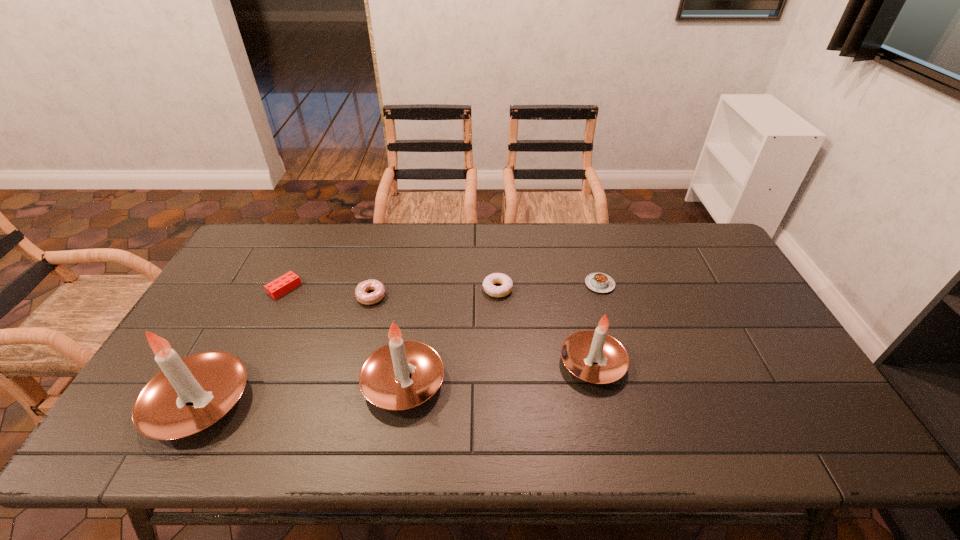
At what (x,y) coordinates should I click in order to perform the action: click on vacant region at the left edge. Please return your answer as a coordinate pair (x, y). Image resolution: width=960 pixels, height=540 pixels. Looking at the image, I should click on (248, 287).

At what (x,y) coordinates should I click in order to perform the action: click on vacant space at the right edge of the desktop. Please return your answer as a coordinate pair (x, y). This screenshot has height=540, width=960. Looking at the image, I should click on (706, 278).

In the image, there is a desktop. Where is `vacant space at the far left corner`? This screenshot has width=960, height=540. vacant space at the far left corner is located at coordinates (279, 245).

Where is `vacant space that's between the right doughnut and the Lego`? vacant space that's between the right doughnut and the Lego is located at coordinates (391, 289).

This screenshot has height=540, width=960. I want to click on free area in between the Lego and the right doughnut, so click(x=391, y=289).

Where is `free space that is in between the pudding and the shortest candle`? The height and width of the screenshot is (540, 960). free space that is in between the pudding and the shortest candle is located at coordinates (596, 324).

You are a GUI agent. You are given a task and a screenshot of the screen. Output one action in this format:
    pyautogui.click(x=<x>, y=<y>)
    Task: Click on the vacant area between the pudding and the Lego
    
    Given the screenshot: What is the action you would take?
    pyautogui.click(x=443, y=286)

Locate an element on the screen. free spot between the right doughnut and the left doughnut is located at coordinates (435, 293).

This screenshot has height=540, width=960. Identify the location of unoccupied position between the third object from right to left and the second tallest candle. (450, 335).

This screenshot has width=960, height=540. Identify the location of vacant area that lies between the leftmost candle and the left doughnut. (285, 349).